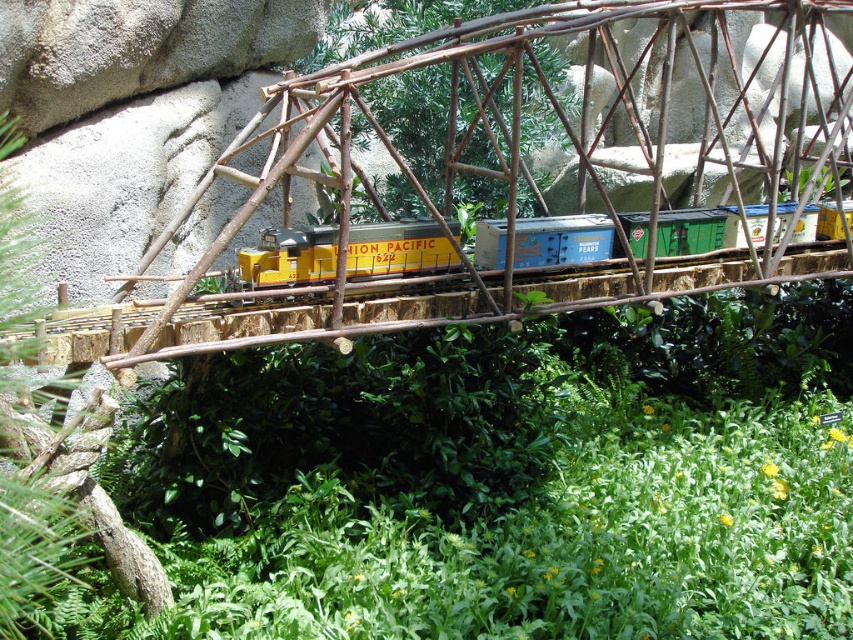
Question: Which point is closer to the camera?

Choices:
 (A) (480, 230)
 (B) (366, 86)

Answer: (A)

Question: Which point appears farthest from the camera in this image?

Choices:
 (A) click(495, 243)
 (B) click(461, 172)

Answer: (B)

Question: Does brown textured wood bridge at center lie behind yellow matte train car at center?

Choices:
 (A) yes
 (B) no

Answer: (A)

Question: Can you confirm if brown textured wood bridge at center is positioned above yellow matte train car at center?

Choices:
 (A) yes
 (B) no

Answer: (A)

Question: Is brown textured wood bridge at center thinner than yellow matte train car at center?

Choices:
 (A) no
 (B) yes

Answer: (B)